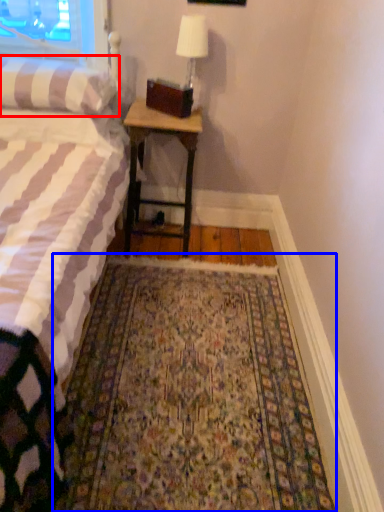
Question: Which of the following is the closest to the observer, pillow (highlighted by a red box) or mat (highlighted by a blue box)?

Choices:
 (A) pillow
 (B) mat

Answer: (B)